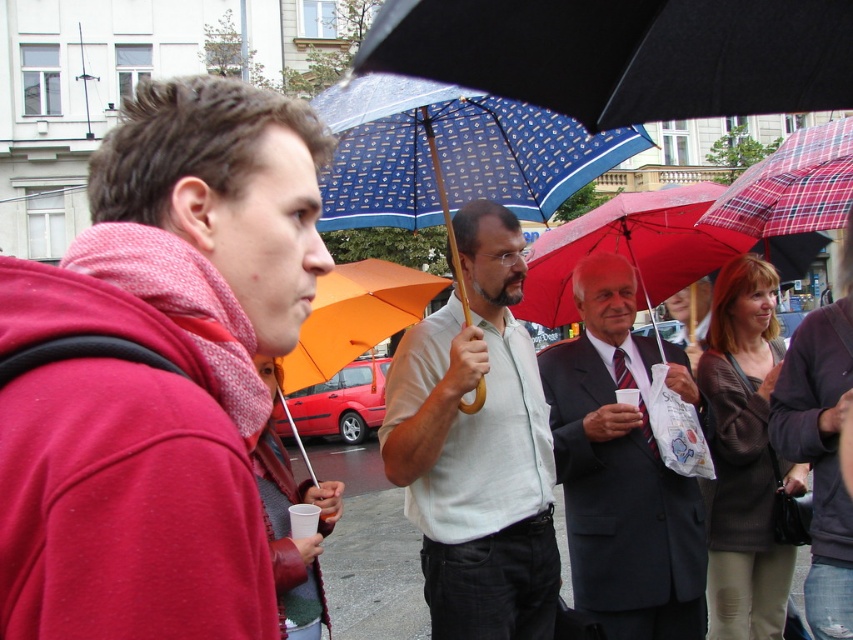
Question: Is blue printed umbrella at center behind red plaid umbrella at center?

Choices:
 (A) yes
 (B) no

Answer: (B)

Question: Based on their relative distances, which object is nearer to the blue printed umbrella at center?

Choices:
 (A) brown leather jacket at right
 (B) blue printed fabric umbrella at upper center

Answer: (B)

Question: Which object appears farthest from the camera in this image?

Choices:
 (A) matte red hoodie at left
 (B) smooth asphalt pavement at center
 (C) blue printed umbrella at center
 (D) light beige shirt at center

Answer: (B)

Question: Which point is closer to the camera taking this photo?

Choices:
 (A) (448, 516)
 (B) (698, 80)

Answer: (B)

Question: Does light beige shirt at center appear on the right side of red plaid umbrella at center?

Choices:
 (A) yes
 (B) no

Answer: (B)

Question: Can you confirm if brown leather jacket at right is wider than plaid fabric umbrella at center?

Choices:
 (A) no
 (B) yes

Answer: (B)